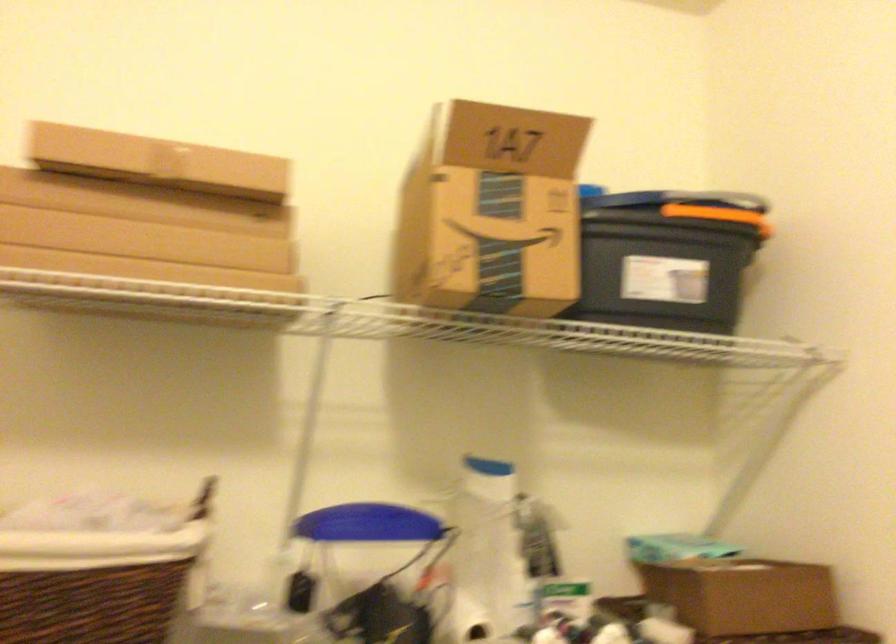
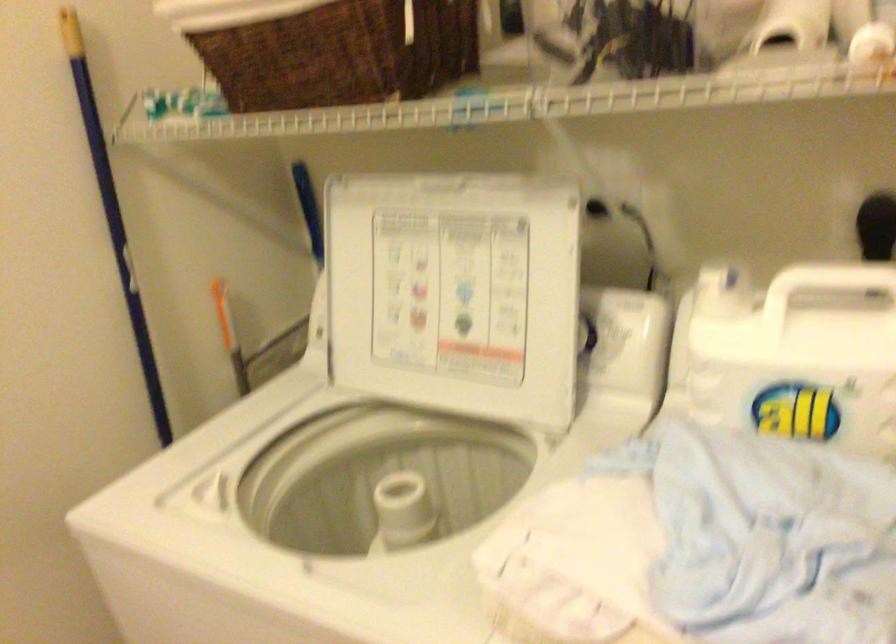
First-person continuous shooting, in which direction is the camera rotating?

The rotation direction of the camera is left-down.